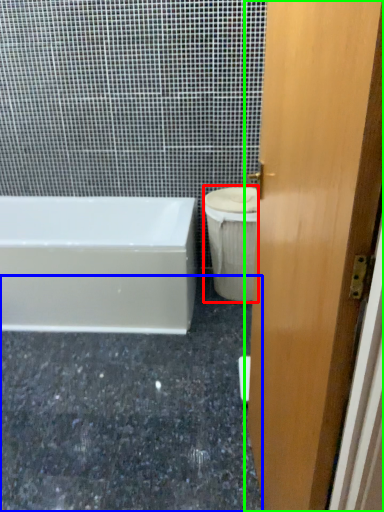
Question: Which is farther away from toilet bowl (highlighted by a red box)? granite (highlighted by a blue box) or door (highlighted by a green box)?

Choices:
 (A) granite
 (B) door

Answer: (B)